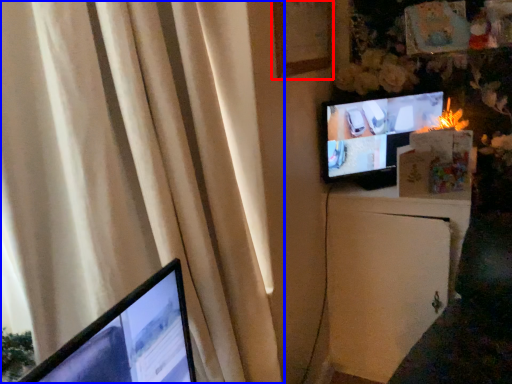
Question: Among these objects, which one is farthest to the camera, picture frame (highlighted by a red box) or curtain (highlighted by a blue box)?

Choices:
 (A) picture frame
 (B) curtain

Answer: (A)